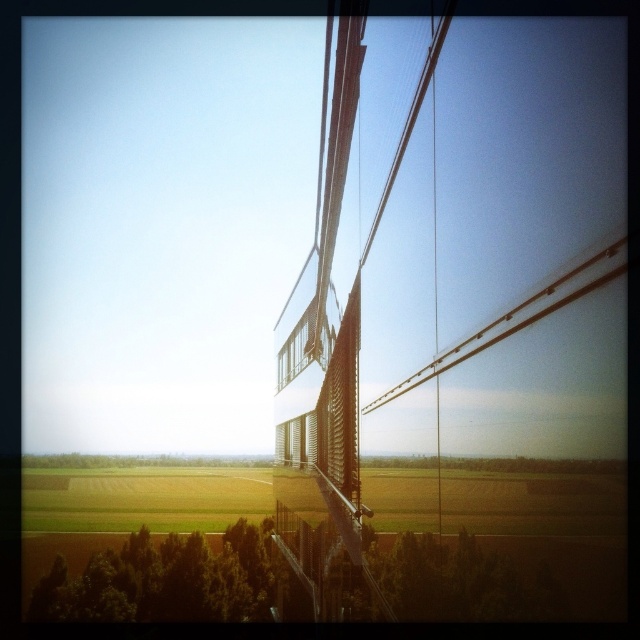
Is green leafy tree at lower left thinner than clear glass window at center?

No.

Is green leafy tree at lower left further to the viewer compared to clear glass window at center?

Yes, green leafy tree at lower left is further from the viewer.

I want to click on green leafy tree at lower left, so click(x=164, y=580).